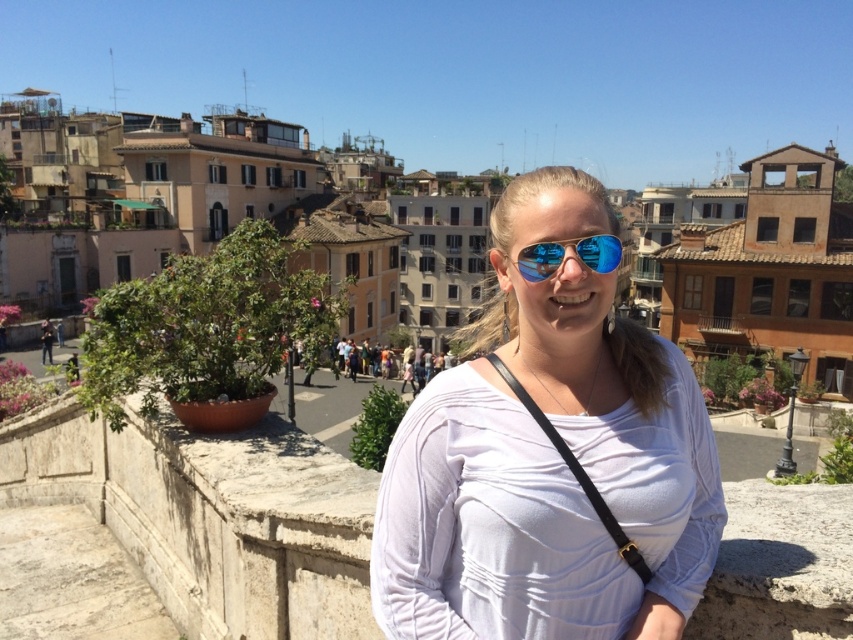
You are a photographer trying to capture a clear shot of the reflective blue aviator sunglasses at center. However, the white matte shirt at center is blocking part of the view. Can you still see the sunglasses through the shirt?

The white matte shirt at center is in front of the reflective blue aviator sunglasses at center, so the shirt is blocking the view of the sunglasses. You cannot see the sunglasses through the shirt.

You are standing at the center of the image and want to step onto the white stone ledge at center. Is the ledge directly in front of you?

The white stone ledge at center is positioned at point (212, 516), so it is directly in front of you at the center of the image.